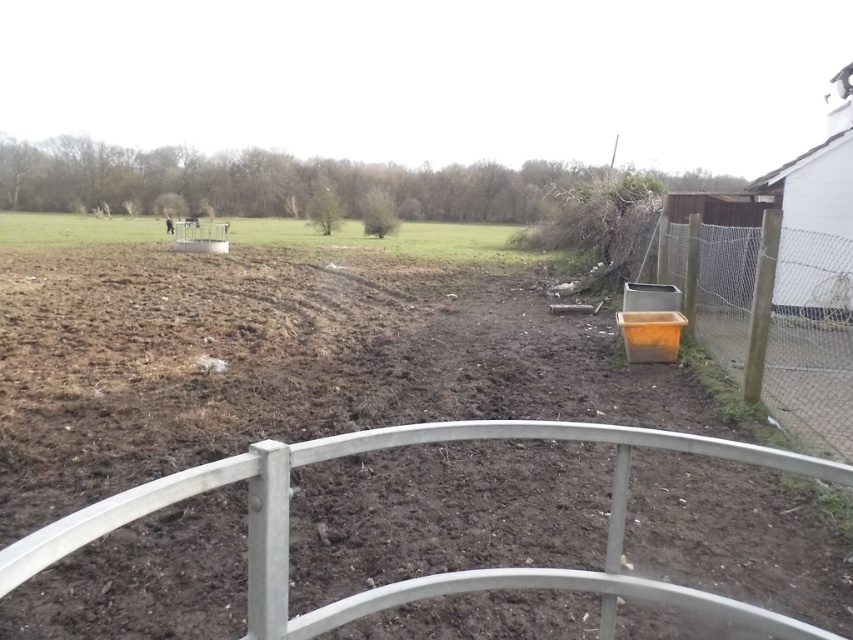
Question: Which point appears closest to the camera in this image?

Choices:
 (A) (48, 228)
 (B) (752, 282)

Answer: (B)

Question: Which object is farther from the camera taking this photo?

Choices:
 (A) green grass at upper left
 (B) orange plastic container at right

Answer: (A)

Question: Is orange plastic container at right above green grass at upper left?

Choices:
 (A) yes
 (B) no

Answer: (B)

Question: In this image, where is orange plastic container at right located relative to green grass at upper left?

Choices:
 (A) above
 (B) below

Answer: (B)

Question: Does orange plastic container at right appear over green grass at upper left?

Choices:
 (A) yes
 (B) no

Answer: (B)

Question: Which of the following is the farthest from the observer?

Choices:
 (A) green grass at upper left
 (B) orange plastic container at right

Answer: (A)